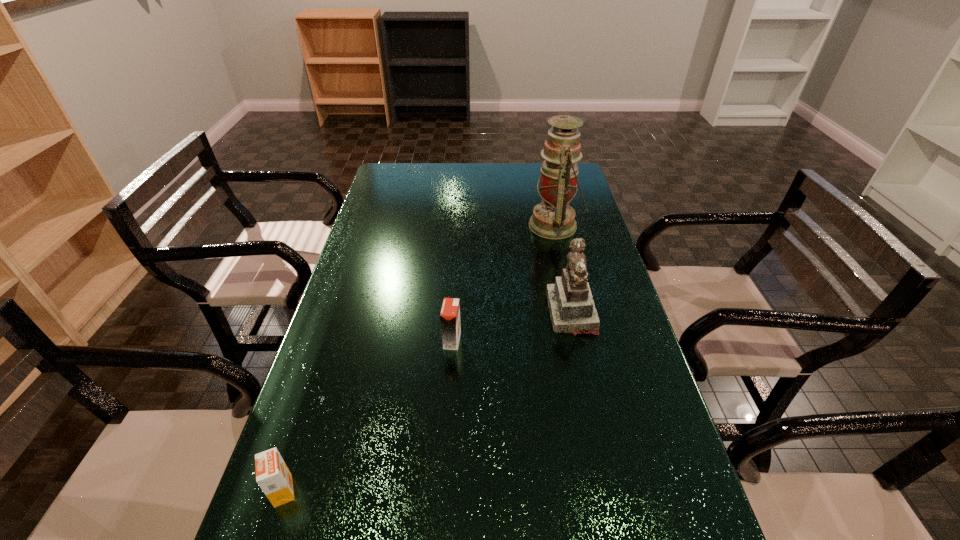
Where is `oil lamp`? The image size is (960, 540). oil lamp is located at coordinates (553, 218).

At what (x,y) coordinates should I click in order to perform the action: click on the farthest object. Please return your answer as a coordinate pair (x, y). Looking at the image, I should click on (553, 218).

Locate an element on the screen. The image size is (960, 540). figurine is located at coordinates (572, 310).

Locate an element on the screen. This screenshot has width=960, height=540. the third object from right to left is located at coordinates (450, 312).

The image size is (960, 540). I want to click on the farther orange juice, so click(450, 312).

Find the location of a particular element. the leftmost object is located at coordinates (272, 475).

The image size is (960, 540). In order to click on the nearer orange juice in this screenshot , I will do `click(272, 475)`.

At what (x,y) coordinates should I click in order to perform the action: click on vacant region located 0.240m on the back of the farthest object. Please return your answer as a coordinate pair (x, y). Looking at the image, I should click on (544, 176).

Find the location of a particular element. The height and width of the screenshot is (540, 960). vacant space located on the front-facing side of the figurine is located at coordinates (419, 313).

The width and height of the screenshot is (960, 540). Find the location of `vacant space located on the front-facing side of the figurine`. vacant space located on the front-facing side of the figurine is located at coordinates (507, 313).